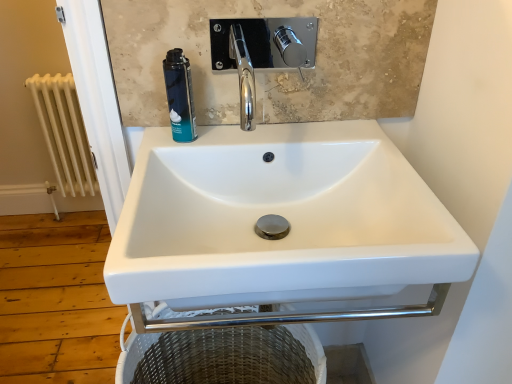
Question: From a real-world perspective, does white painted metal radiator at left sit lower than blue matte shaving cream can at upper left?

Choices:
 (A) yes
 (B) no

Answer: (A)

Question: Is white painted metal radiator at left at the left side of blue matte shaving cream can at upper left?

Choices:
 (A) yes
 (B) no

Answer: (A)

Question: From the image's perspective, is white painted metal radiator at left above blue matte shaving cream can at upper left?

Choices:
 (A) no
 (B) yes

Answer: (B)

Question: Is white painted metal radiator at left touching blue matte shaving cream can at upper left?

Choices:
 (A) yes
 (B) no

Answer: (B)

Question: Is white painted metal radiator at left oriented away from blue matte shaving cream can at upper left?

Choices:
 (A) no
 (B) yes

Answer: (A)

Question: From a real-world perspective, is blue matte shaving cream can at upper left above or below white painted metal radiator at left?

Choices:
 (A) below
 (B) above

Answer: (B)

Question: Considering the positions of blue matte shaving cream can at upper left and white painted metal radiator at left in the image, is blue matte shaving cream can at upper left wider or thinner than white painted metal radiator at left?

Choices:
 (A) wide
 (B) thin

Answer: (B)

Question: Considering the positions of blue matte shaving cream can at upper left and white painted metal radiator at left in the image, is blue matte shaving cream can at upper left bigger or smaller than white painted metal radiator at left?

Choices:
 (A) big
 (B) small

Answer: (B)

Question: Is blue matte shaving cream can at upper left situated inside white painted metal radiator at left or outside?

Choices:
 (A) inside
 (B) outside

Answer: (B)

Question: Considering the relative positions of white ceramic sink at center and blue matte shaving cream can at upper left in the image provided, is white ceramic sink at center to the left or to the right of blue matte shaving cream can at upper left?

Choices:
 (A) left
 (B) right

Answer: (B)

Question: From the image's perspective, is white ceramic sink at center above or below blue matte shaving cream can at upper left?

Choices:
 (A) above
 (B) below

Answer: (B)

Question: In terms of width, does white ceramic sink at center look wider or thinner when compared to blue matte shaving cream can at upper left?

Choices:
 (A) wide
 (B) thin

Answer: (A)

Question: In terms of height, does white ceramic sink at center look taller or shorter compared to blue matte shaving cream can at upper left?

Choices:
 (A) tall
 (B) short

Answer: (A)

Question: Is white ceramic sink at center situated inside white painted metal radiator at left or outside?

Choices:
 (A) outside
 (B) inside

Answer: (A)

Question: From a real-world perspective, relative to white painted metal radiator at left, is white ceramic sink at center vertically above or below?

Choices:
 (A) above
 (B) below

Answer: (A)